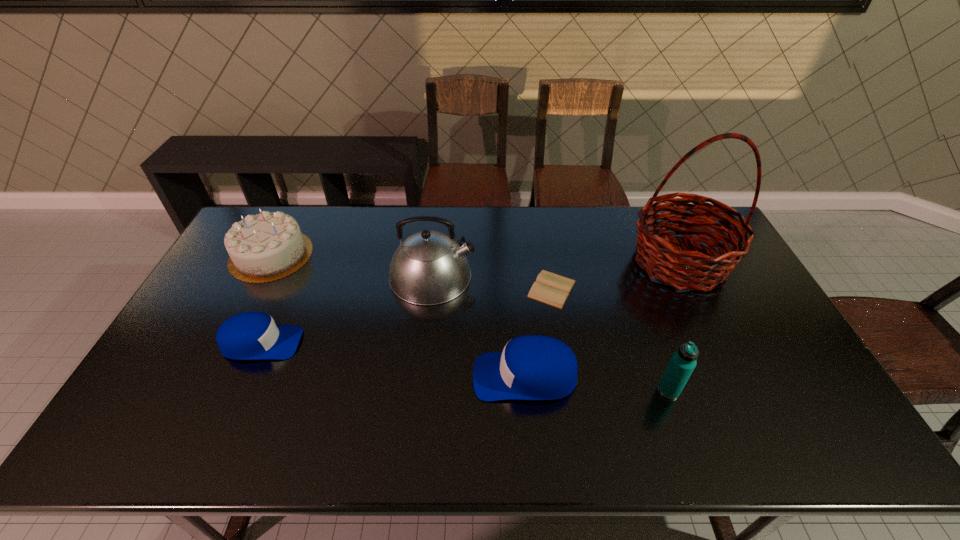
You are a GUI agent. You are given a task and a screenshot of the screen. Output one action in this format:
    pyautogui.click(x=<x>, y=<y>)
    Task: Click on the baseball cap located in the near edge section of the desktop
    The image size is (960, 540).
    Given the screenshot: What is the action you would take?
    (x=533, y=367)

Identify the location of water bottle present at the near edge. (682, 363).

The height and width of the screenshot is (540, 960). Find the location of `baseball cap situated at the left edge`. baseball cap situated at the left edge is located at coordinates (250, 335).

I want to click on birthday cake that is at the left edge, so click(268, 246).

Find the location of a particular element. The width and height of the screenshot is (960, 540). object that is at the right edge is located at coordinates [683, 269].

What are the coordinates of `object present at the far left corner` in the screenshot? It's located at (268, 246).

Where is `object that is at the far right corner`? The image size is (960, 540). object that is at the far right corner is located at coordinates (683, 269).

The height and width of the screenshot is (540, 960). Identify the location of vacant space at the far edge of the desktop. (467, 242).

Find the location of `free space at the near edge of the desktop`. free space at the near edge of the desktop is located at coordinates (679, 402).

You are a GUI agent. You are given a task and a screenshot of the screen. Output one action in this format:
    pyautogui.click(x=<x>, y=<y>)
    Task: Click on the vacant space at the left edge of the desktop
    This screenshot has height=540, width=960.
    Given the screenshot: What is the action you would take?
    pyautogui.click(x=215, y=371)